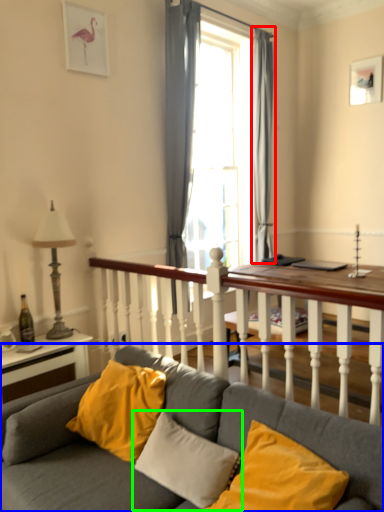
Question: Based on their relative distances, which object is nearer to curtain (highlighted by a red box)? Choose from studio couch (highlighted by a blue box) and pillow (highlighted by a green box).

Choices:
 (A) studio couch
 (B) pillow

Answer: (B)